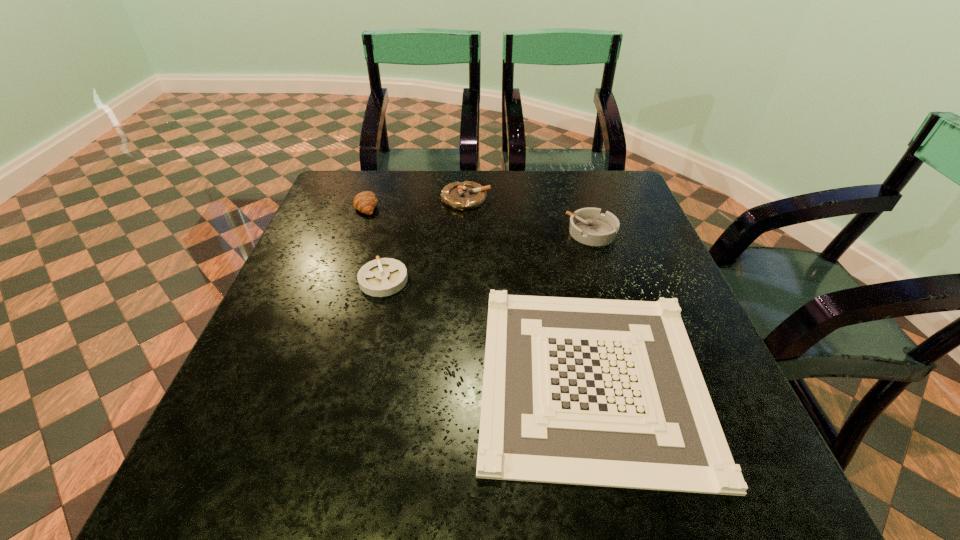
I want to click on vacant space located on the back of the fourth object from right to left, so click(391, 251).

At what (x,y) coordinates should I click in order to perform the action: click on vacant region located 0.370m on the back of the shortest object. Please return your answer as a coordinate pair (x, y). Looking at the image, I should click on (553, 204).

At what (x,y) coordinates should I click in order to perform the action: click on crescent roll present at the far edge. Please return your answer as a coordinate pair (x, y). Looking at the image, I should click on (365, 202).

At what (x,y) coordinates should I click in order to perform the action: click on ashtray that is at the far edge. Please return your answer as a coordinate pair (x, y). The width and height of the screenshot is (960, 540). Looking at the image, I should click on (467, 195).

Identify the location of object located at the near edge. (598, 392).

At what (x,y) coordinates should I click in order to perform the action: click on object that is at the left edge. Please return your answer as a coordinate pair (x, y). The image size is (960, 540). Looking at the image, I should click on (365, 202).

Image resolution: width=960 pixels, height=540 pixels. In order to click on ashtray that is positioned at the right edge in this screenshot , I will do `click(589, 226)`.

The width and height of the screenshot is (960, 540). What are the coordinates of `checkerboard that is at the right edge` in the screenshot? It's located at (598, 392).

Locate an element on the screen. object situated at the far left corner is located at coordinates (365, 202).

Identify the location of object present at the near right corner. (598, 392).